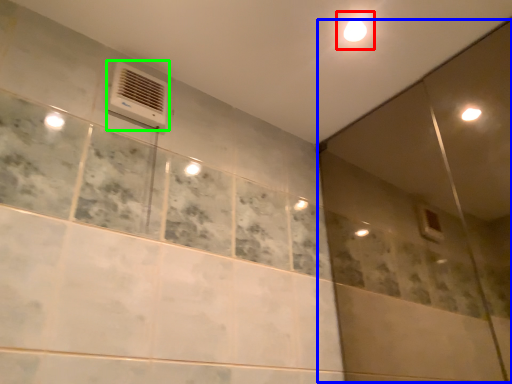
Question: Based on their relative distances, which object is farther from light (highlighted by a red box)? Choose from screen door (highlighted by a blue box) and air conditioning (highlighted by a green box).

Choices:
 (A) screen door
 (B) air conditioning

Answer: (A)